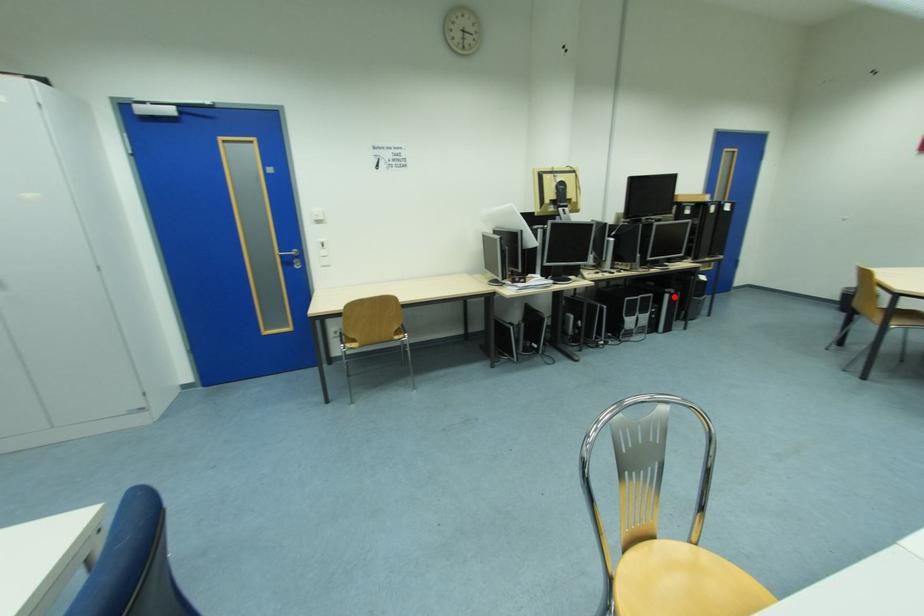
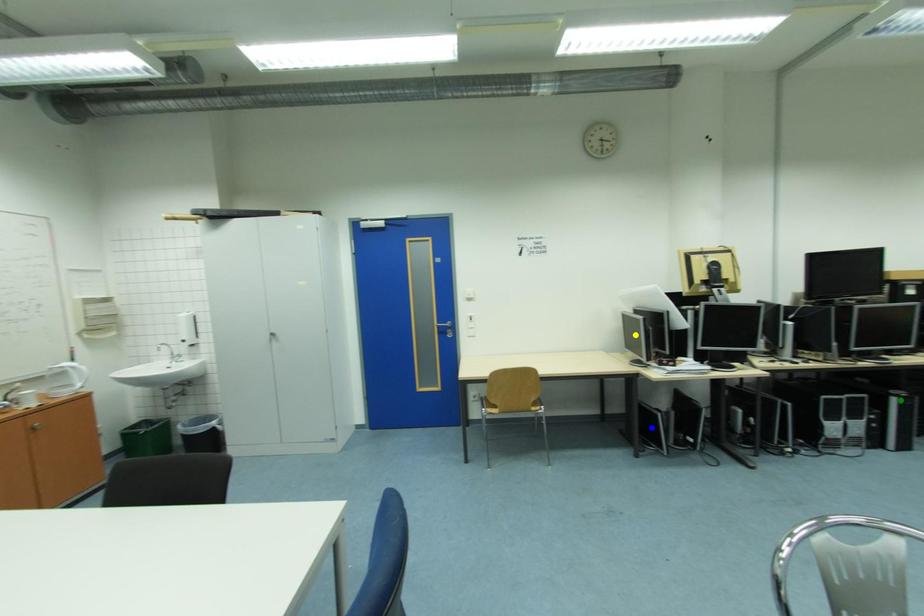
Question: I am providing you with two images of the same scene from different viewpoints. A red point is marked on the first image. You are given multiple points on the second image. In image 2, which mark is for the same physical point as the one in image 1?

Choices:
 (A) green point
 (B) yellow point
 (C) blue point

Answer: (A)